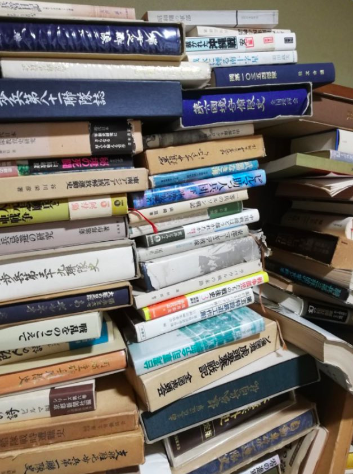
You are a GUI agent. You are given a task and a screenshot of the screen. Output one action in this format:
    pyautogui.click(x=<x>, y=<y>)
    Task: Click on the 2 tan books left lower corner
    This screenshot has height=474, width=353.
    Given the screenshot: What is the action you would take?
    pyautogui.click(x=46, y=465), pyautogui.click(x=44, y=438)